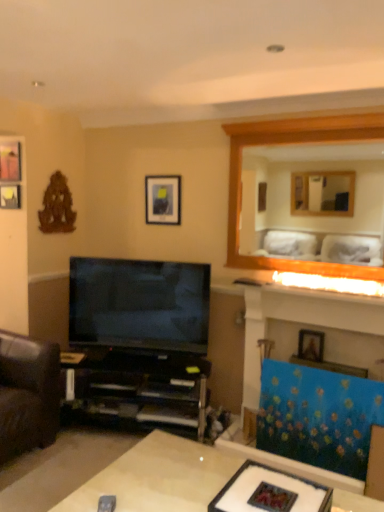
Question: Is the depth of wooden picture frame at upper right, which is the fourth picture frame in back-to-front order, less than that of matte glass frame at center?

Choices:
 (A) yes
 (B) no

Answer: (B)

Question: Does wooden picture frame at upper right, the 4th picture frame viewed from the left, have a greater width compared to matte glass frame at center?

Choices:
 (A) no
 (B) yes

Answer: (A)

Question: From a real-world perspective, does wooden picture frame at upper right, which ranks as the first picture frame in bottom-to-top order, sit lower than matte glass frame at center?

Choices:
 (A) no
 (B) yes

Answer: (A)

Question: Can you confirm if wooden picture frame at upper right, which ranks as the first picture frame in bottom-to-top order, is positioned to the left of matte glass frame at center?

Choices:
 (A) no
 (B) yes

Answer: (A)

Question: Is wooden picture frame at upper right, the 4th picture frame viewed from the left, behind matte glass frame at center?

Choices:
 (A) yes
 (B) no

Answer: (A)

Question: Looking at the image, does black plastic shelf at lower left seem bigger or smaller compared to matte black picture frame at upper left, which is the 2th picture frame from top to bottom?

Choices:
 (A) big
 (B) small

Answer: (A)

Question: In the image, is black plastic shelf at lower left on the left side or the right side of matte black picture frame at upper left, placed as the first picture frame when sorted from left to right?

Choices:
 (A) right
 (B) left

Answer: (A)

Question: From a real-world perspective, relative to matte black picture frame at upper left, the 4th picture frame in the right-to-left sequence, is black plastic shelf at lower left vertically above or below?

Choices:
 (A) below
 (B) above

Answer: (A)

Question: Is black plastic shelf at lower left inside the boundaries of matte black picture frame at upper left, which is the 2th picture frame from top to bottom, or outside?

Choices:
 (A) inside
 (B) outside

Answer: (B)

Question: In the image, is white glossy table at lower center positioned in front of or behind matte black picture frame at upper center, the 4th picture frame in the front-to-back sequence?

Choices:
 (A) front
 (B) behind

Answer: (A)

Question: Does point (125, 467) appear closer or farther from the camera than point (148, 221)?

Choices:
 (A) farther
 (B) closer

Answer: (B)

Question: Considering the positions of white glossy table at lower center and matte black picture frame at upper center, which is counted as the 3th picture frame, starting from the left, in the image, is white glossy table at lower center wider or thinner than matte black picture frame at upper center, which is counted as the 3th picture frame, starting from the left,?

Choices:
 (A) wide
 (B) thin

Answer: (A)

Question: Would you say white glossy table at lower center is to the left or to the right of matte black picture frame at upper center, the 4th picture frame in the front-to-back sequence, in the picture?

Choices:
 (A) left
 (B) right

Answer: (B)

Question: Is white glossy table at lower center to the left or to the right of wooden mirror at upper right in the image?

Choices:
 (A) right
 (B) left

Answer: (B)

Question: Considering the positions of white glossy table at lower center and wooden mirror at upper right in the image, is white glossy table at lower center taller or shorter than wooden mirror at upper right?

Choices:
 (A) tall
 (B) short

Answer: (B)